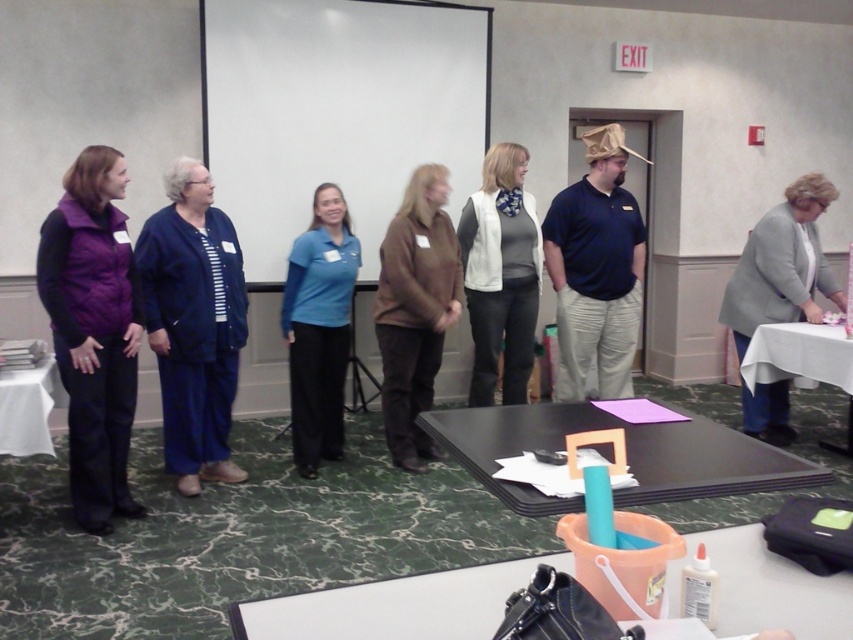
You are standing in the conference room and notice two items at the center of the scene. Which one is positioned to the left? The blue fabric pants at center or the white matte vest at center?

The blue fabric pants at center are to the left of the white matte vest at center.

You are organizing a clothing donation drive and need to determine which item is more suitable for a narrow hanger. Which of the two items, the blue fabric pants at center or the white matte vest at center, is thinner and thus better suited for a narrow hanger?

The blue fabric pants at center is thinner than the white matte vest at center, making it more suitable for a narrow hanger.